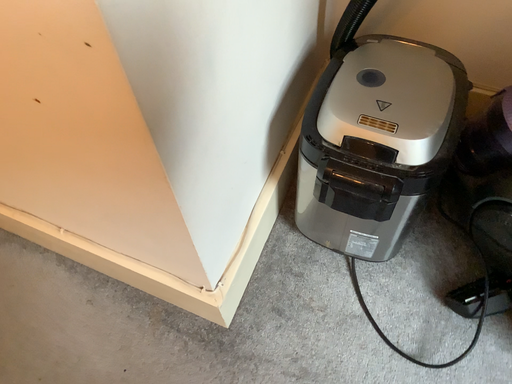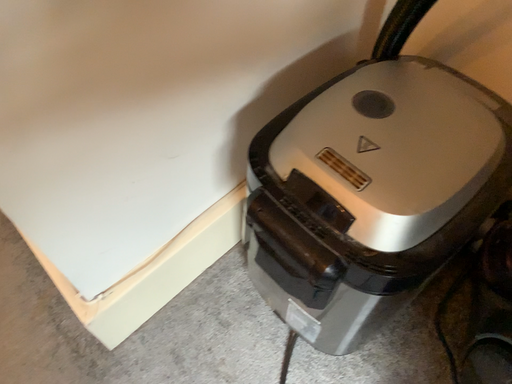
Question: Which way did the camera rotate in the video?

Choices:
 (A) rotated left
 (B) rotated right

Answer: (A)